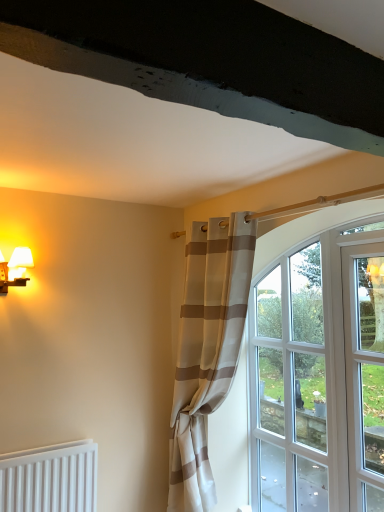
Question: Would you say clear glass door at right contains matte white table lamp at left?

Choices:
 (A) no
 (B) yes

Answer: (A)

Question: Is clear glass door at right with matte white table lamp at left?

Choices:
 (A) yes
 (B) no

Answer: (B)

Question: Can you confirm if clear glass door at right is shorter than matte white table lamp at left?

Choices:
 (A) yes
 (B) no

Answer: (B)

Question: From a real-world perspective, is clear glass door at right beneath matte white table lamp at left?

Choices:
 (A) no
 (B) yes

Answer: (B)

Question: Is clear glass door at right aimed at matte white table lamp at left?

Choices:
 (A) yes
 (B) no

Answer: (B)

Question: Can you confirm if clear glass door at right is wider than matte white table lamp at left?

Choices:
 (A) no
 (B) yes

Answer: (A)

Question: Is beige striped curtain at center bigger than matte white table lamp at left?

Choices:
 (A) no
 (B) yes

Answer: (B)

Question: Is beige striped curtain at center positioned before matte white table lamp at left?

Choices:
 (A) no
 (B) yes

Answer: (B)

Question: Considering the relative sizes of beige striped curtain at center and matte white table lamp at left in the image provided, is beige striped curtain at center smaller than matte white table lamp at left?

Choices:
 (A) no
 (B) yes

Answer: (A)

Question: Is matte white table lamp at left located within beige striped curtain at center?

Choices:
 (A) yes
 (B) no

Answer: (B)

Question: Considering the relative sizes of beige striped curtain at center and matte white table lamp at left in the image provided, is beige striped curtain at center wider than matte white table lamp at left?

Choices:
 (A) no
 (B) yes

Answer: (B)

Question: From a real-world perspective, is beige striped curtain at center on matte white table lamp at left?

Choices:
 (A) no
 (B) yes

Answer: (A)

Question: Is beige striped curtain at center oriented towards clear glass door at right?

Choices:
 (A) no
 (B) yes

Answer: (A)